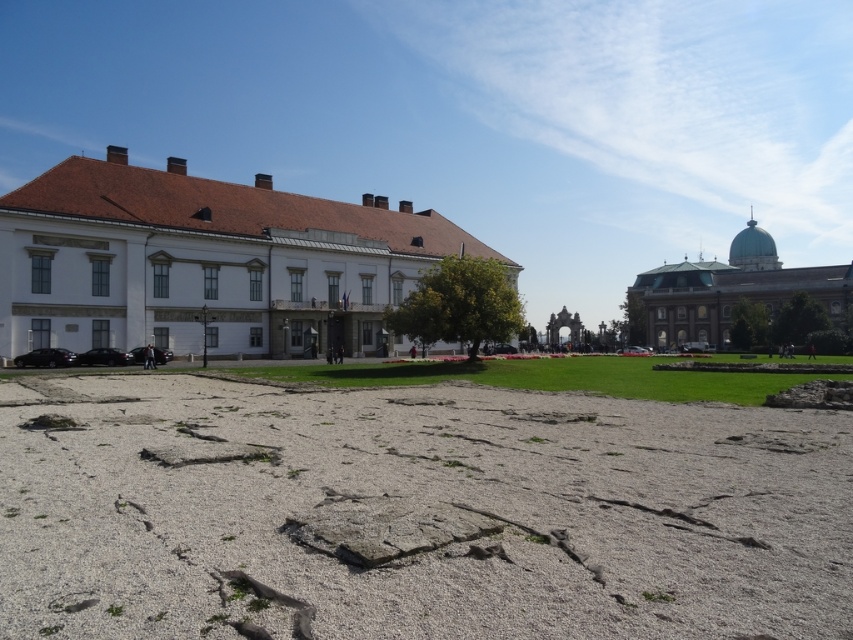
You are an architect visiting the plaza and want to compare the two buildings. Which building is larger in size between the white smooth building at center and the green dome building at upper right?

The white smooth building at center has a smaller size compared to the green dome building at upper right, so the green dome building at upper right is larger in size.

You are standing at the point with coordinates point (206, 260) in the plaza. What is the closest object to you?

The closest object to you at point (206, 260) is the white smooth building at center.